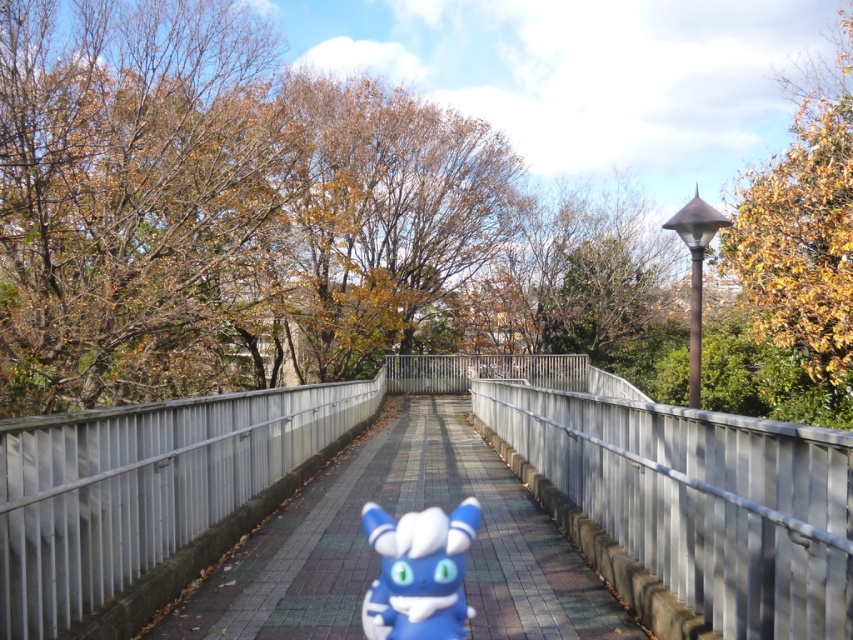
You are a delivery robot with a 1.2 meter wide package. You need to cross the bridge and pass through the area between the metallic silver rail at center and the blue rubber toy at center. Can your package fit through that space?

The metallic silver rail at center is narrower than the blue rubber toy at center. Since the rail is less wide, the total space between them might be sufficient for the package. However, without exact measurements of the gap, it is uncertain. The description only states the rail is narrower than the toy, but not the distance between them. Therefore, it is unclear if the 1.2 meter package can fit through the space between them.

You are standing on the bridge and want to place a small blue plush toy on the bridge surface near the metallic gray rail at center. Based on the coordinates provided in the description, can you determine if the plush toy is already positioned close to the rail?

The metallic gray rail at center is located at point (143, 486). Since the plush toy is positioned on the bridge facing forward and angled towards the camera, its placement is near the rail, so yes, the plush toy is already close to the metallic gray rail at center.

You are a delivery person carrying a large package that is 2 meters wide. You need to cross the bridge and see the smooth concrete walkway at center and the blue rubber toy at center. Can your package fit through the space between the railings on the bridge?

The smooth concrete walkway at center is wider than the blue rubber toy at center. Since the walkway is wider, the 2 meter wide package should fit as long as it stays centered on the walkway.